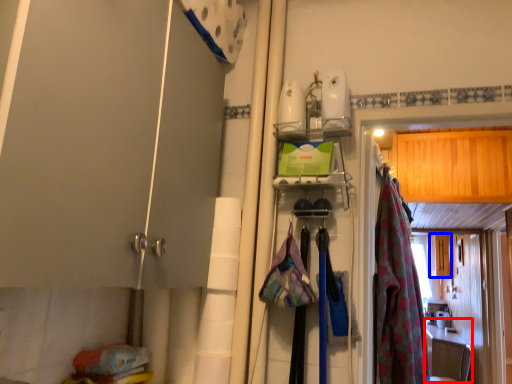
Question: Which point is closer to the camera, counter top (highlighted by a red box) or cabinetry (highlighted by a blue box)?

Choices:
 (A) counter top
 (B) cabinetry

Answer: (A)